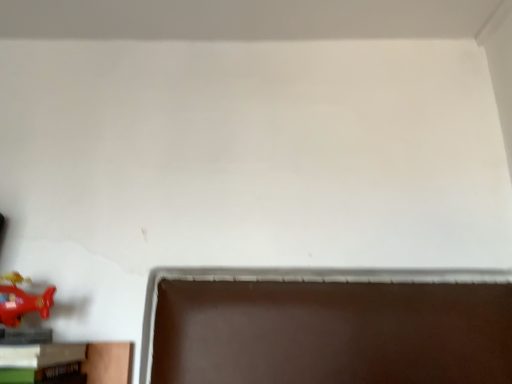
Question: Is wooden bookshelf at lower left far away from shiny red airplane at lower left?

Choices:
 (A) yes
 (B) no

Answer: (B)

Question: Does wooden bookshelf at lower left lie behind shiny red airplane at lower left?

Choices:
 (A) yes
 (B) no

Answer: (B)

Question: Does wooden bookshelf at lower left have a smaller size compared to shiny red airplane at lower left?

Choices:
 (A) yes
 (B) no

Answer: (B)

Question: From the image's perspective, is wooden bookshelf at lower left on shiny red airplane at lower left?

Choices:
 (A) no
 (B) yes

Answer: (A)

Question: Can you confirm if wooden bookshelf at lower left is thinner than shiny red airplane at lower left?

Choices:
 (A) yes
 (B) no

Answer: (B)

Question: Is wooden bookshelf at lower left shorter than shiny red airplane at lower left?

Choices:
 (A) yes
 (B) no

Answer: (B)

Question: Is shiny red airplane at lower left at the left side of wooden bookshelf at lower left?

Choices:
 (A) yes
 (B) no

Answer: (A)

Question: Could wooden bookshelf at lower left be considered to be inside shiny red airplane at lower left?

Choices:
 (A) no
 (B) yes

Answer: (A)

Question: Considering the relative positions of shiny red airplane at lower left and wooden bookshelf at lower left in the image provided, is shiny red airplane at lower left behind wooden bookshelf at lower left?

Choices:
 (A) no
 (B) yes

Answer: (B)

Question: From the image's perspective, would you say shiny red airplane at lower left is shown under wooden bookshelf at lower left?

Choices:
 (A) no
 (B) yes

Answer: (A)

Question: Is shiny red airplane at lower left looking in the opposite direction of wooden bookshelf at lower left?

Choices:
 (A) yes
 (B) no

Answer: (B)

Question: Is shiny red airplane at lower left at the right side of wooden bookshelf at lower left?

Choices:
 (A) no
 (B) yes

Answer: (A)

Question: Is shiny red airplane at lower left in front of or behind wooden bookshelf at lower left in the image?

Choices:
 (A) front
 (B) behind

Answer: (B)